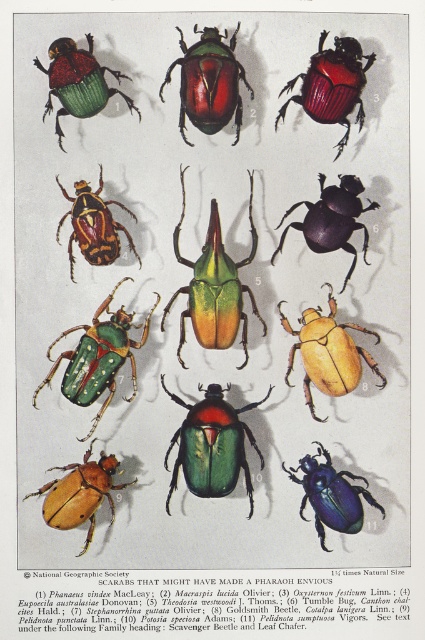
Is point (331, 88) positioned behind point (322, 452)?

No, it is not.

Does shiny metallic beetle at upper center have a lesser width compared to metallic blue beetle at center?

Indeed, shiny metallic beetle at upper center has a lesser width compared to metallic blue beetle at center.

Who is more forward, (303,72) or (353,524)?

Point (353,524) is in front.

You are a GUI agent. You are given a task and a screenshot of the screen. Output one action in this format:
    pyautogui.click(x=<x>, y=<y>)
    Task: Click on the shiny metallic beetle at upper center
    This screenshot has width=425, height=640.
    Given the screenshot: What is the action you would take?
    pyautogui.click(x=331, y=84)

Is green glossy beetle at center-left further to camera compared to glossy metallic beetle at center?

Yes, green glossy beetle at center-left is further from the viewer.

Is point (113, 314) positioned after point (186, 81)?

Yes, point (113, 314) is behind point (186, 81).

Image resolution: width=425 pixels, height=640 pixels. I want to click on green glossy beetle at center-left, so click(98, 356).

Between shiny metallic beetle at upper center and shiny metallic beetle at upper left, which one is positioned lower?

shiny metallic beetle at upper left is lower down.

Can you confirm if shiny metallic beetle at upper center is positioned to the right of shiny metallic beetle at upper left?

Indeed, shiny metallic beetle at upper center is positioned on the right side of shiny metallic beetle at upper left.

What do you see at coordinates (331, 84) in the screenshot? The width and height of the screenshot is (425, 640). I see `shiny metallic beetle at upper center` at bounding box center [331, 84].

In order to click on shiny metallic beetle at upper center in this screenshot , I will do `click(331, 84)`.